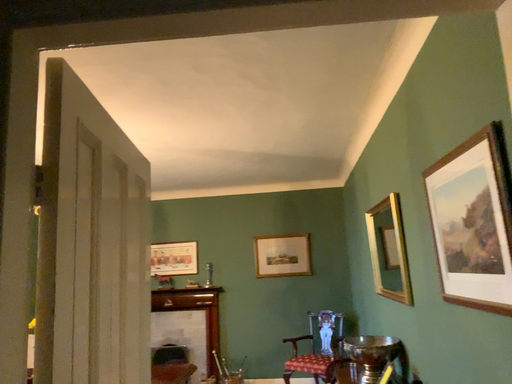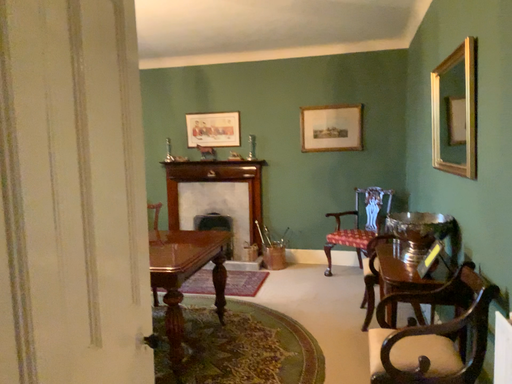
Question: Which way did the camera rotate in the video?

Choices:
 (A) rotated right
 (B) rotated left

Answer: (B)